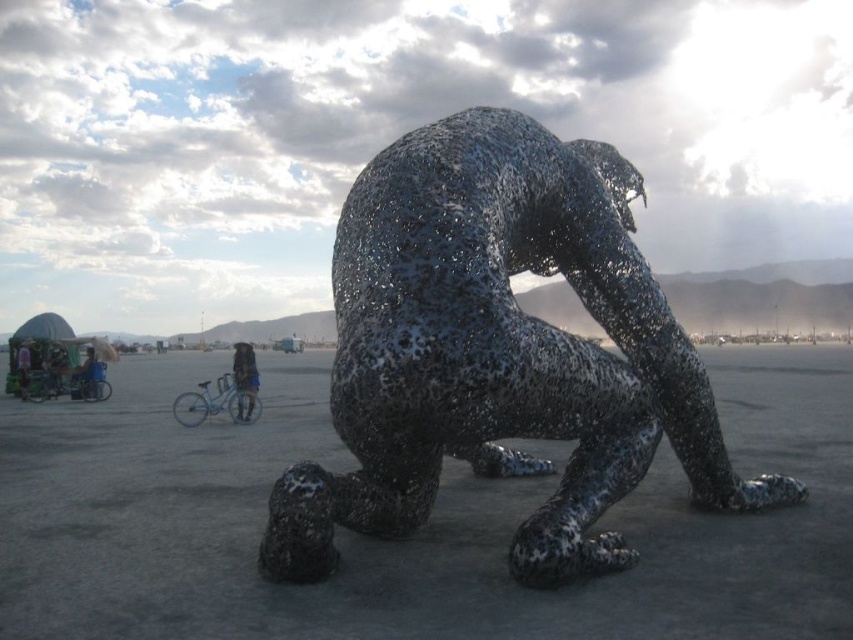
Question: Which point is farther to the camera?

Choices:
 (A) (253, 400)
 (B) (22, 362)
 (C) (576, 285)

Answer: (B)

Question: Where is metallic wire sculpture at center located in relation to denim jacket at lower left in the image?

Choices:
 (A) below
 (B) above

Answer: (B)

Question: Is metallic wire sculpture at center behind denim jacket at lower left?

Choices:
 (A) yes
 (B) no

Answer: (B)

Question: Can you confirm if metallic wire sculpture at center is thinner than denim jacket at lower center?

Choices:
 (A) yes
 (B) no

Answer: (B)

Question: Which of the following is the closest to the observer?

Choices:
 (A) (349, 276)
 (B) (26, 390)
 (C) (231, 358)

Answer: (A)

Question: Which object is the farthest from the denim jacket at lower left?

Choices:
 (A) metallic wire sculpture at center
 (B) denim jacket at lower center

Answer: (A)